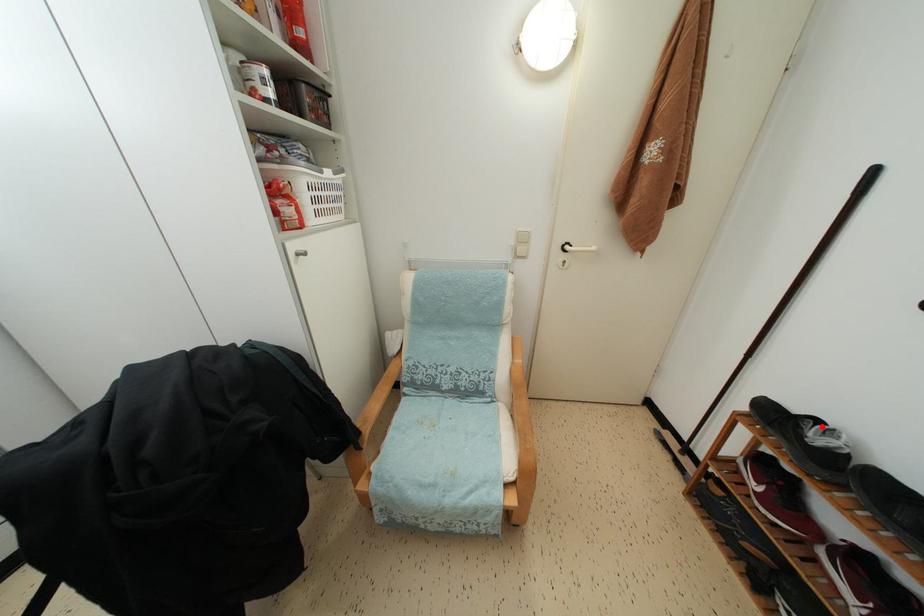
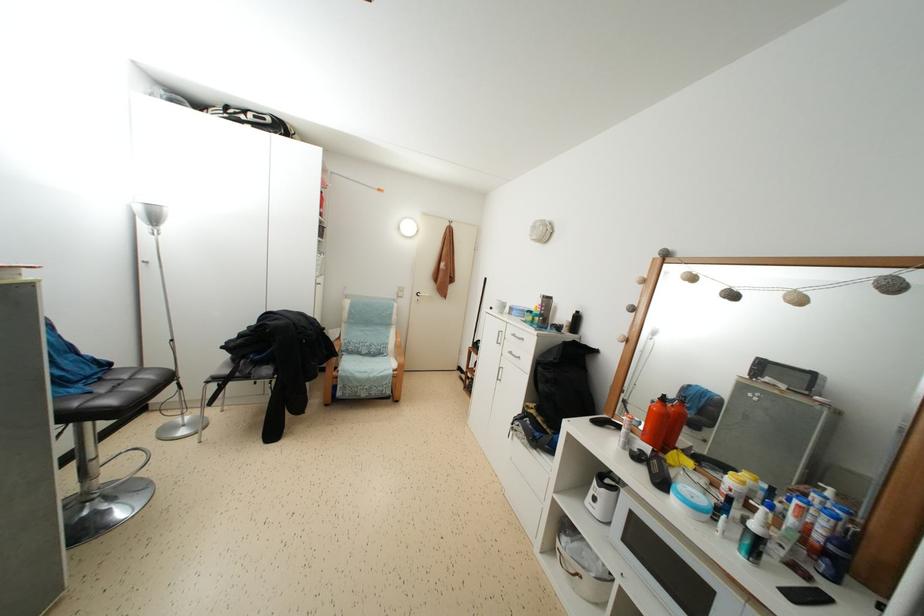
Question: I am providing you with two images of the same scene from different viewpoints. A red point is marked on the first image. Can you still see the location of the red point in image 2?

Choices:
 (A) Yes
 (B) No

Answer: (B)